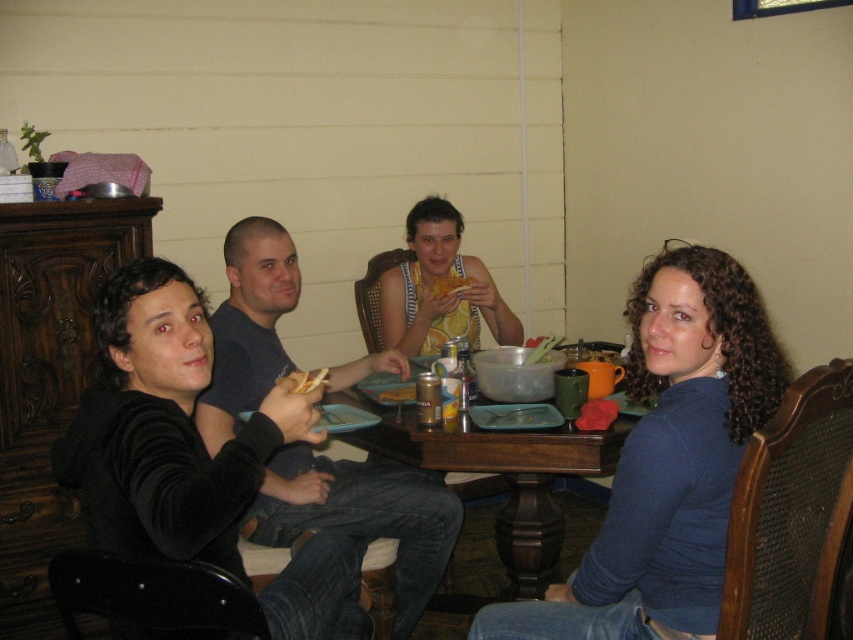
Question: Is yellow fabric tank top at center thinner than yellow matte bread at center?

Choices:
 (A) yes
 (B) no

Answer: (B)

Question: Does blue matte shirt at center lie behind dark blue shirt at center?

Choices:
 (A) yes
 (B) no

Answer: (B)

Question: Does metallic can at table center appear on the right side of golden crispy bread at center?

Choices:
 (A) no
 (B) yes

Answer: (B)

Question: Which of the following is the farthest from the observer?

Choices:
 (A) (473, 333)
 (B) (384, 394)
 (C) (344, 484)

Answer: (A)

Question: Which object appears closest to the camera in this image?

Choices:
 (A) blue matte shirt at center
 (B) shiny metallic can at center
 (C) yellow matte bread at center
 (D) golden crispy bread at center

Answer: (A)

Question: Which point is farther to the camera?

Choices:
 (A) dark blue shirt at center
 (B) blue matte shirt at center
 (C) golden crispy bread at center

Answer: (A)